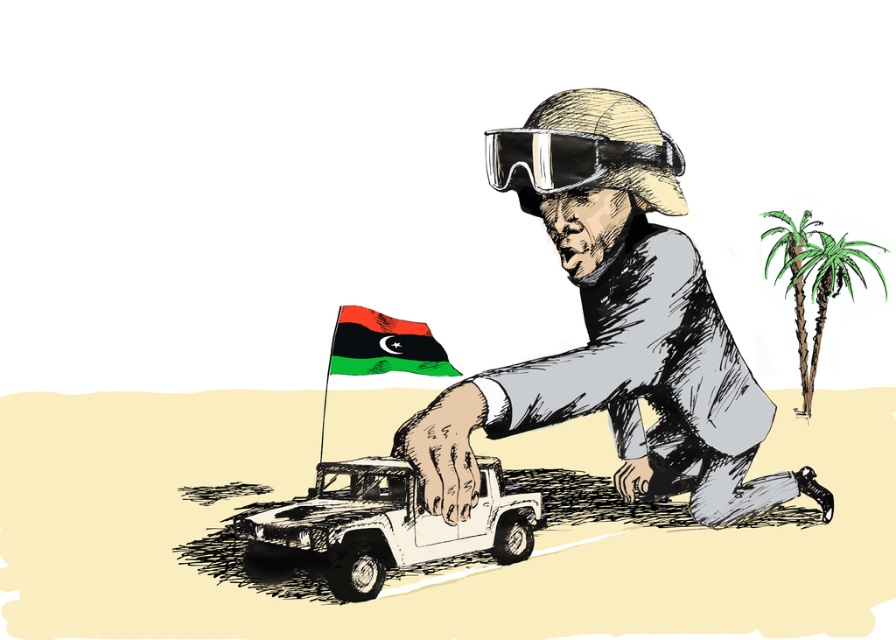
Question: Which object appears closest to the camera in this image?

Choices:
 (A) green leafy palm tree at right
 (B) green textured palm tree at right
 (C) white matte truck at center
 (D) gray paper-like hat at upper center

Answer: (D)

Question: Among these objects, which one is nearest to the camera?

Choices:
 (A) gray paper-like hat at upper center
 (B) green textured palm tree at right

Answer: (A)

Question: From the image, what is the correct spatial relationship of green textured palm tree at right in relation to green leafy palm tree at right?

Choices:
 (A) below
 (B) above

Answer: (B)

Question: Is white matte truck at center in front of green leafy palm tree at right?

Choices:
 (A) yes
 (B) no

Answer: (A)

Question: Is white matte truck at center below clear plastic goggles at upper center?

Choices:
 (A) yes
 (B) no

Answer: (A)

Question: Which of these objects is positioned farthest from the green matte flag at center?

Choices:
 (A) gray paper-like hat at upper center
 (B) clear plastic goggles at upper center

Answer: (B)